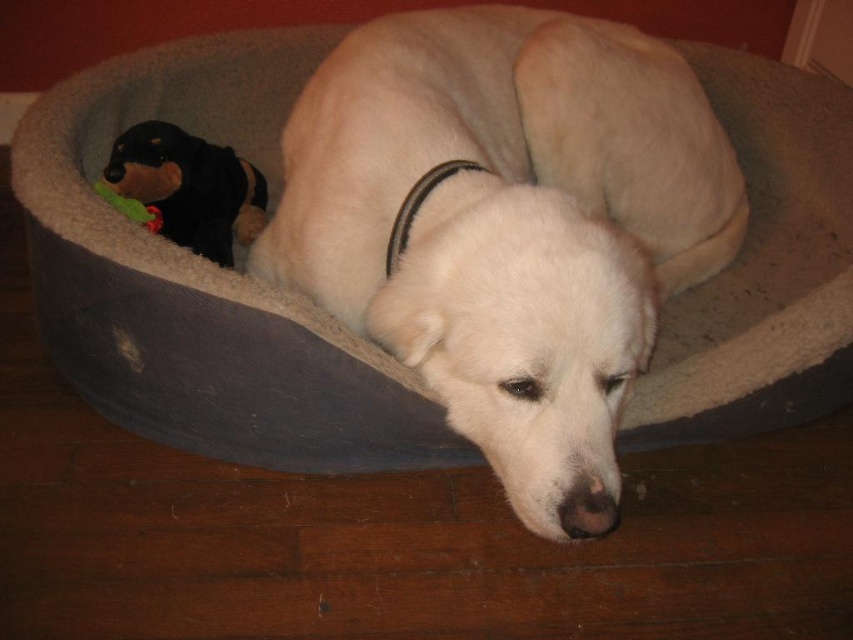
Question: Which is farther from the white fur dog at center?

Choices:
 (A) black/leather neckband at center
 (B) black plush toy at upper left
 (C) green plush toy at left

Answer: (C)

Question: Among these points, which one is nearest to the camera?

Choices:
 (A) (173, 225)
 (B) (103, 189)
 (C) (480, 349)

Answer: (C)

Question: Does black plush toy at upper left appear over green plush toy at left?

Choices:
 (A) yes
 (B) no

Answer: (A)

Question: Where is black plush toy at upper left located in relation to green plush toy at left in the image?

Choices:
 (A) right
 (B) left

Answer: (A)

Question: Can you confirm if white fur dog at center is positioned above green plush toy at left?

Choices:
 (A) no
 (B) yes

Answer: (A)

Question: Which of the following is the closest to the observer?

Choices:
 (A) (717, 131)
 (B) (209, 147)

Answer: (B)